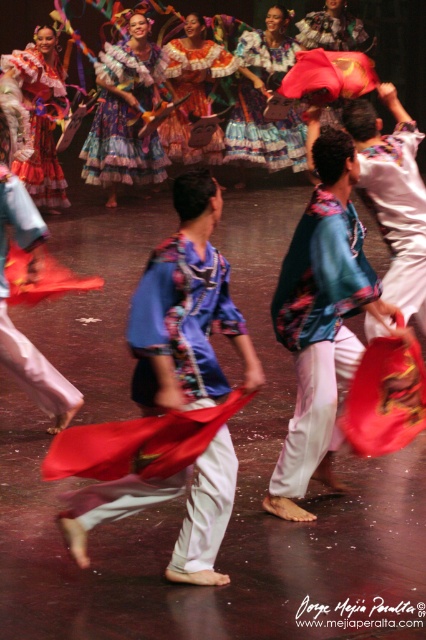
Between matte blue fabric at center and multicolored satin dress at center, which one appears on the right side from the viewer's perspective?

matte blue fabric at center is more to the right.

Which is below, matte blue fabric at center or multicolored satin dress at center?

Positioned lower is matte blue fabric at center.

The width and height of the screenshot is (426, 640). Describe the element at coordinates (181, 324) in the screenshot. I see `matte blue fabric at center` at that location.

Identify the location of matte blue fabric at center. (181, 324).

Does matte blue fabric at center appear on the left side of matte orange fabric at center?

Incorrect, matte blue fabric at center is not on the left side of matte orange fabric at center.

Which of these two, matte blue fabric at center or matte orange fabric at center, stands taller?

With more height is matte orange fabric at center.

Which is in front, point (138, 502) or point (201, 83)?

Point (138, 502) is in front.

This screenshot has height=640, width=426. Identify the location of matte blue fabric at center. (181, 324).

Can you confirm if teal floral blouse at center is positioned to the left of multicolored fringed skirt at upper center?

Correct, you'll find teal floral blouse at center to the left of multicolored fringed skirt at upper center.

Is teal floral blouse at center thinner than multicolored fringed skirt at upper center?

Indeed, teal floral blouse at center has a lesser width compared to multicolored fringed skirt at upper center.

Is point (314, 412) more distant than point (276, 77)?

No.

Identify the location of teal floral blouse at center. Image resolution: width=426 pixels, height=640 pixels. (319, 330).